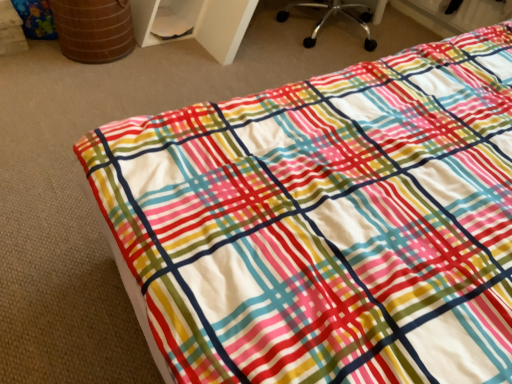
Find the location of a particular element. metallic silver chair at upper center is located at coordinates click(x=329, y=16).

The width and height of the screenshot is (512, 384). What do you see at coordinates (329, 16) in the screenshot?
I see `metallic silver chair at upper center` at bounding box center [329, 16].

At what (x,y) coordinates should I click in order to perform the action: click on metallic silver chair at upper center. Please return your answer as a coordinate pair (x, y). Image resolution: width=512 pixels, height=384 pixels. Looking at the image, I should click on (329, 16).